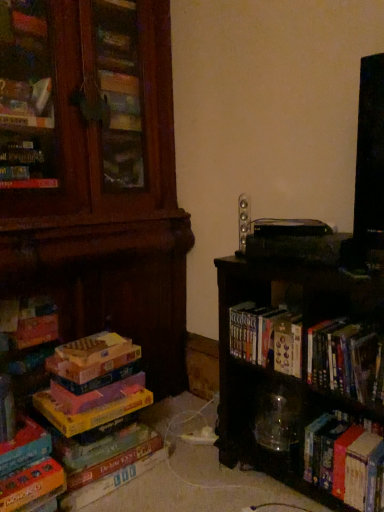
Identify the location of free location above orange cardboard monopoly game at lower left, the fifth book from the right (from a real-world perspective). This screenshot has height=512, width=384. (19, 440).